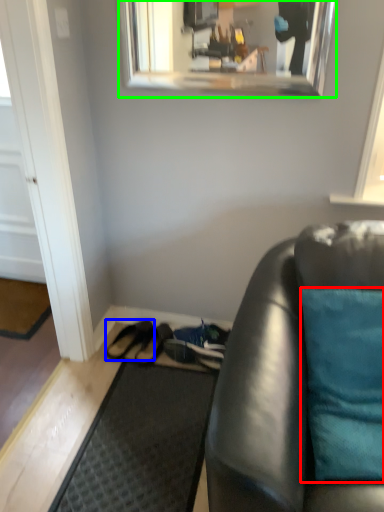
Question: Based on their relative distances, which object is farther from pillow (highlighted by a red box)? Choose from footwear (highlighted by a blue box) and mirror (highlighted by a green box).

Choices:
 (A) footwear
 (B) mirror

Answer: (B)